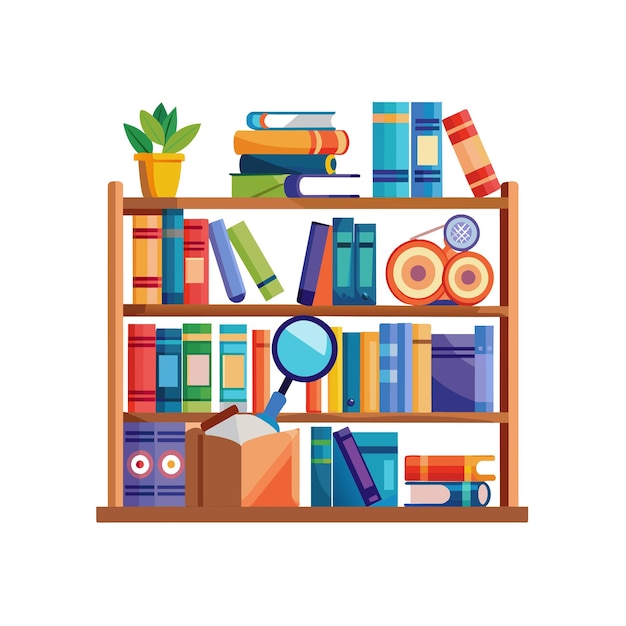
Locate the book lying on its side in the image. Your answer should be formatted as a list of tuples, i.e. [(x1, y1), (x2, y2), ...], where each tuple contains the x and y coordinates of a point satisfying the conditions above.

[(448, 503), (444, 470), (304, 190), (298, 165), (297, 143), (295, 121)]